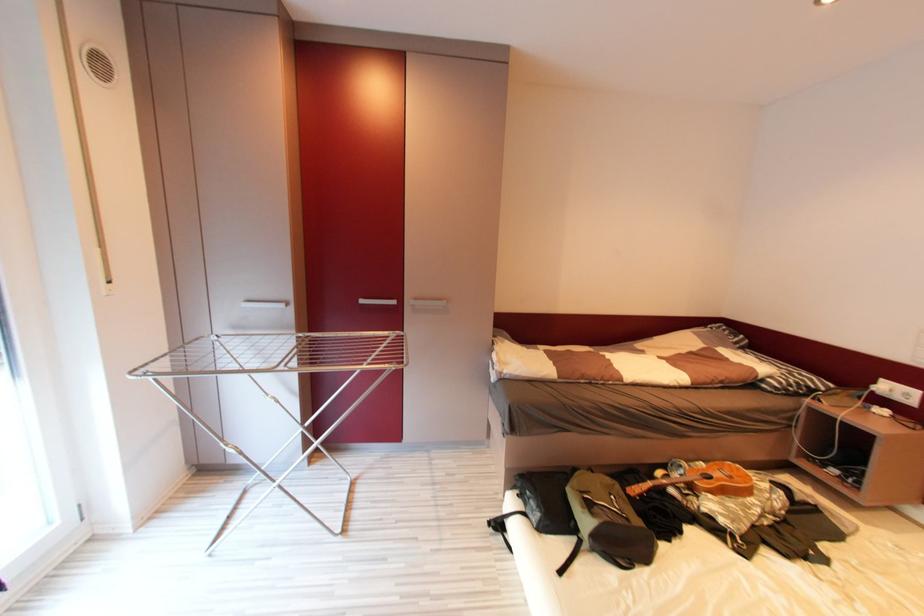
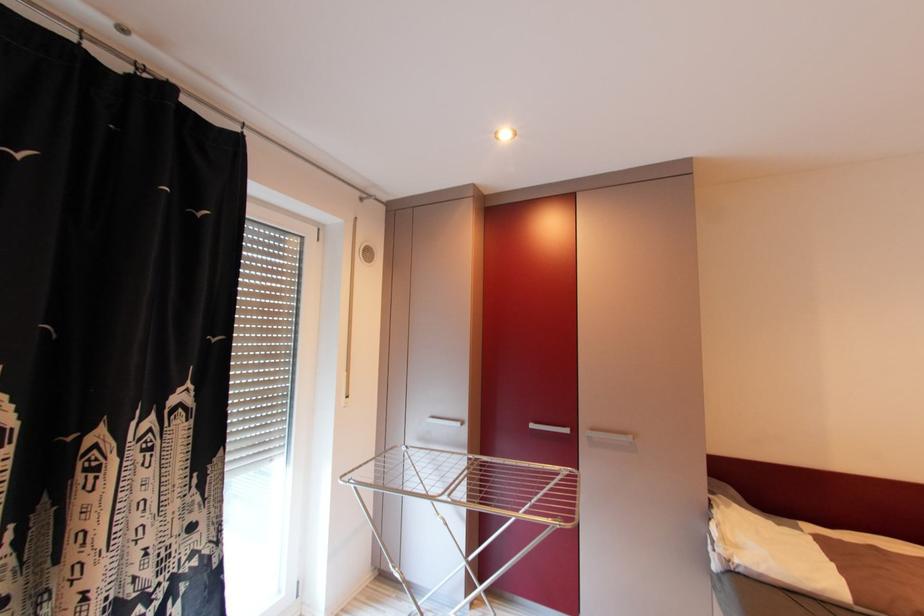
Consider the image. First-person continuous shooting, in which direction is the camera rotating?

The camera rotated toward left-up.